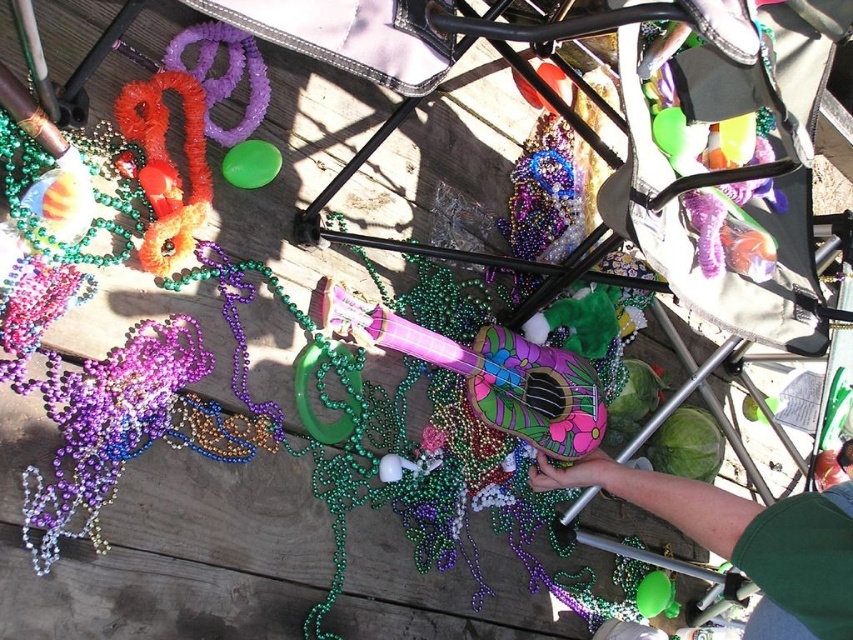
Based on the photo, you are a guest at the Mardi Gras party and want to grab the green fabric hand at lower right and the orange fuzzy pipe at upper left. Which object is taller?

The green fabric hand at lower right is not as tall as the orange fuzzy pipe at upper left, so the orange fuzzy pipe at upper left is taller.

You are a party planner arranging decorations for Mardi Gras. You have a green fabric hand at lower right and an orange fuzzy pipe at upper left. Which object is closer to the ground?

The green fabric hand at lower right is positioned under the orange fuzzy pipe at upper left, so it is closer to the ground.

In the scene shown: You are a party planner organizing a Mardi Gras event. You have a narrow shelf that can only hold items no thicker than the green fabric hand at lower right. Can the painted wood ukulele at center fit on this shelf?

The green fabric hand at lower right is thinner than the painted wood ukulele at center, so the ukulele is thicker and cannot fit on the narrow shelf.